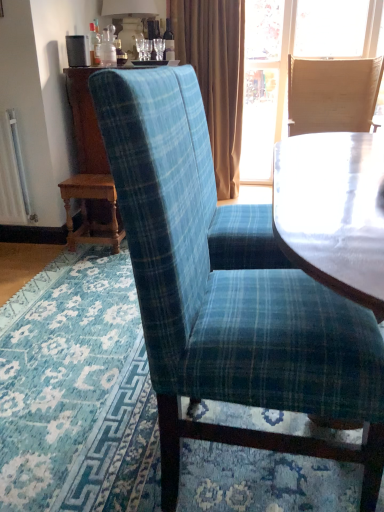
Identify the location of brown velvet curtain at upper center. This screenshot has height=512, width=384. (216, 75).

Locate an element on the screen. The image size is (384, 512). blue plaid fabric chair at center, the 2th chair viewed from the top is located at coordinates (227, 301).

You are a GUI agent. You are given a task and a screenshot of the screen. Output one action in this format:
    pyautogui.click(x=<x>, y=<y>)
    Task: Click on the white ceramic lamp at upper center
    
    Given the screenshot: What is the action you would take?
    click(130, 19)

What do you see at coordinates (130, 19) in the screenshot? I see `white ceramic lamp at upper center` at bounding box center [130, 19].

I want to click on brown velvet curtain at upper center, so click(216, 75).

From the image's perspective, between blue plaid fabric chair at center, the first chair when ordered from front to back, and wooden table at lower left, who is located below?

blue plaid fabric chair at center, the first chair when ordered from front to back, is shown below in the image.

Is blue plaid fabric chair at center, which is the second chair from back to front, inside the boundaries of wooden table at lower left, or outside?

blue plaid fabric chair at center, which is the second chair from back to front, is spatially situated outside wooden table at lower left.

Considering the relative sizes of blue plaid fabric chair at center, the first chair when ordered from front to back, and wooden table at lower left in the image provided, is blue plaid fabric chair at center, the first chair when ordered from front to back, thinner than wooden table at lower left?

No, blue plaid fabric chair at center, the first chair when ordered from front to back, is not thinner than wooden table at lower left.

In the scene shown: Is blue plaid fabric chair at center, which ranks as the first chair in left-to-right order, beside wooden table at lower left?

No, blue plaid fabric chair at center, which ranks as the first chair in left-to-right order, is not making contact with wooden table at lower left.

Considering their positions, is brown velvet curtain at upper center located in front of or behind light brown woven chair at upper right, acting as the second chair starting from the left?

In the image, brown velvet curtain at upper center appears behind light brown woven chair at upper right, acting as the second chair starting from the left.

Is brown velvet curtain at upper center facing towards light brown woven chair at upper right, acting as the second chair starting from the left?

No, brown velvet curtain at upper center is not facing towards light brown woven chair at upper right, acting as the second chair starting from the left.

This screenshot has width=384, height=512. I want to click on curtain above the light brown woven chair at upper right, acting as the second chair starting from the left (from a real-world perspective), so click(x=216, y=75).

Can you confirm if brown velvet curtain at upper center is wider than light brown woven chair at upper right, which ranks as the 2th chair in bottom-to-top order?

Incorrect, the width of brown velvet curtain at upper center does not surpass that of light brown woven chair at upper right, which ranks as the 2th chair in bottom-to-top order.

How much distance is there between brown velvet curtain at upper center and white ceramic lamp at upper center?

They are 20.40 inches apart.

How many degrees apart are the facing directions of brown velvet curtain at upper center and white ceramic lamp at upper center?

There is a 89.2-degree angle between the facing directions of brown velvet curtain at upper center and white ceramic lamp at upper center.

Could you tell me if brown velvet curtain at upper center is turned towards white ceramic lamp at upper center?

No, brown velvet curtain at upper center is not aimed at white ceramic lamp at upper center.

From the image's perspective, between brown velvet curtain at upper center and white ceramic lamp at upper center, which one is located above?

white ceramic lamp at upper center.

At what (x,y) coordinates should I click in order to perform the action: click on chair located below the light brown woven chair at upper right, which ranks as the 2th chair in bottom-to-top order (from the image's perspective). Please return your answer as a coordinate pair (x, y). This screenshot has height=512, width=384. Looking at the image, I should click on (227, 301).

Is point (190, 397) closer to camera compared to point (332, 106)?

That is True.

From the image's perspective, between blue plaid fabric chair at center, the first chair when ordered from front to back, and light brown woven chair at upper right, the 2th chair from the front, which one is located above?

light brown woven chair at upper right, the 2th chair from the front, from the image's perspective.

From the image's perspective, between light brown woven chair at upper right, which is the 1th chair in right-to-left order, and brown velvet curtain at upper center, which one is located above?

brown velvet curtain at upper center.

From a real-world perspective, is light brown woven chair at upper right, which is the 1th chair in right-to-left order, beneath brown velvet curtain at upper center?

Yes, from a real-world perspective, light brown woven chair at upper right, which is the 1th chair in right-to-left order, is beneath brown velvet curtain at upper center.

In the image, is light brown woven chair at upper right, which is the 1th chair in right-to-left order, on the left side or the right side of brown velvet curtain at upper center?

Clearly, light brown woven chair at upper right, which is the 1th chair in right-to-left order, is on the right of brown velvet curtain at upper center in the image.

Which object is further away from the camera, light brown woven chair at upper right, acting as the first chair starting from the back, or brown velvet curtain at upper center?

brown velvet curtain at upper center is further from the camera.

Locate an element on the screen. chair behind the wooden table at lower left is located at coordinates (332, 94).

Is light brown woven chair at upper right, the 2th chair from the front, shorter than wooden table at lower left?

Incorrect, the height of light brown woven chair at upper right, the 2th chair from the front, does not fall short of that of wooden table at lower left.

In the scene shown: Are light brown woven chair at upper right, the 2th chair from the front, and wooden table at lower left far apart?

That's right, there is a large distance between light brown woven chair at upper right, the 2th chair from the front, and wooden table at lower left.

Is light brown woven chair at upper right, acting as the first chair starting from the back, at the right side of blue plaid fabric chair at center, which ranks as the first chair in left-to-right order?

Indeed, light brown woven chair at upper right, acting as the first chair starting from the back, is positioned on the right side of blue plaid fabric chair at center, which ranks as the first chair in left-to-right order.

Considering the sizes of light brown woven chair at upper right, which ranks as the 2th chair in bottom-to-top order, and blue plaid fabric chair at center, the first chair from the bottom, in the image, is light brown woven chair at upper right, which ranks as the 2th chair in bottom-to-top order, wider or thinner than blue plaid fabric chair at center, the first chair from the bottom,?

Clearly, light brown woven chair at upper right, which ranks as the 2th chair in bottom-to-top order, has more width compared to blue plaid fabric chair at center, the first chair from the bottom.

Where is `chair on the right side of blue plaid fabric chair at center, which ranks as the first chair in left-to-right order`? chair on the right side of blue plaid fabric chair at center, which ranks as the first chair in left-to-right order is located at coordinates (332, 94).

Is light brown woven chair at upper right, which is the 1th chair in right-to-left order, completely or partially outside of blue plaid fabric chair at center, the 2th chair viewed from the top?

Absolutely, light brown woven chair at upper right, which is the 1th chair in right-to-left order, is external to blue plaid fabric chair at center, the 2th chair viewed from the top.

Which chair is the 1st one when counting from the right side of the wooden table at lower left? Please provide its 2D coordinates.

[(227, 301)]

The width and height of the screenshot is (384, 512). In order to click on the 1st chair below the brown velvet curtain at upper center (from the image's perspective) in this screenshot , I will do `click(332, 94)`.

From the image, which object appears to be nearer to light brown woven chair at upper right, which is the 1th chair in right-to-left order, white ceramic lamp at upper center or blue plaid fabric chair at center, the first chair from the bottom?

white ceramic lamp at upper center.

Which object lies nearer to the anchor point white ceramic lamp at upper center, blue plaid fabric chair at center, the first chair from the bottom, or brown velvet curtain at upper center?

Based on the image, brown velvet curtain at upper center appears to be nearer to white ceramic lamp at upper center.

Based on their spatial positions, is blue plaid fabric chair at center, which ranks as the first chair in left-to-right order, or wooden table at lower left further from brown velvet curtain at upper center?

blue plaid fabric chair at center, which ranks as the first chair in left-to-right order, is positioned further to the anchor brown velvet curtain at upper center.

From the image, which object appears to be nearer to blue plaid fabric chair at center, the first chair from the bottom, light brown woven chair at upper right, which ranks as the first chair in top-to-bottom order, or white ceramic lamp at upper center?

Based on the image, white ceramic lamp at upper center appears to be nearer to blue plaid fabric chair at center, the first chair from the bottom.

Based on their spatial positions, is light brown woven chair at upper right, acting as the second chair starting from the left, or blue plaid fabric chair at center, the second chair viewed from the right, further from wooden table at lower left?

Based on the image, light brown woven chair at upper right, acting as the second chair starting from the left, appears to be further to wooden table at lower left.

When comparing their distances from white ceramic lamp at upper center, does blue plaid fabric chair at center, which is the second chair from back to front, or light brown woven chair at upper right, acting as the first chair starting from the back, seem closer?

Based on the image, light brown woven chair at upper right, acting as the first chair starting from the back, appears to be nearer to white ceramic lamp at upper center.

From the image, which object appears to be nearer to light brown woven chair at upper right, the 2th chair from the front, wooden table at lower left or brown velvet curtain at upper center?

brown velvet curtain at upper center is closer to light brown woven chair at upper right, the 2th chair from the front.

From the image, which object appears to be nearer to white ceramic lamp at upper center, blue plaid fabric chair at center, the first chair from the bottom, or wooden table at lower left?

wooden table at lower left is positioned closer to the anchor white ceramic lamp at upper center.

Identify the location of table positioned between blue plaid fabric chair at center, the first chair from the bottom, and light brown woven chair at upper right, acting as the second chair starting from the left, from near to far. (86, 210).

Locate an element on the screen. This screenshot has height=512, width=384. table between blue plaid fabric chair at center, the first chair from the bottom, and white ceramic lamp at upper center in the front-back direction is located at coordinates (86, 210).

Identify the location of curtain between white ceramic lamp at upper center and light brown woven chair at upper right, which ranks as the 2th chair in bottom-to-top order, in the horizontal direction. (216, 75).

Identify the location of curtain between white ceramic lamp at upper center and wooden table at lower left in the vertical direction. (216, 75).